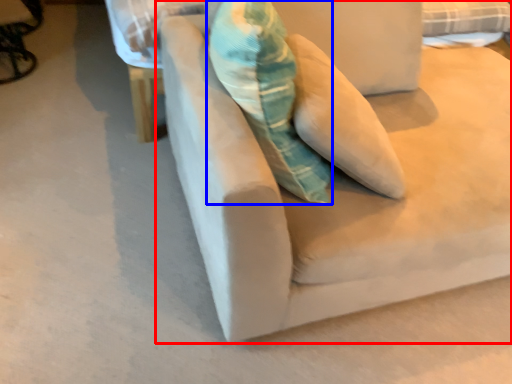
Question: Among these objects, which one is nearest to the camera, studio couch (highlighted by a red box) or throw pillow (highlighted by a blue box)?

Choices:
 (A) studio couch
 (B) throw pillow

Answer: (A)